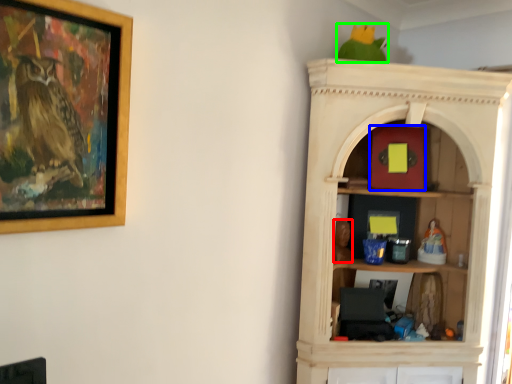
Question: Based on their relative distances, which object is farther from toy (highlighted by a red box)? Choose from toy (highlighted by a blue box) and parrot (highlighted by a green box).

Choices:
 (A) toy
 (B) parrot

Answer: (B)